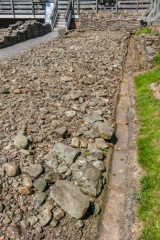
Locate an element on the screen. The image size is (160, 240). hand rail is located at coordinates (67, 9).